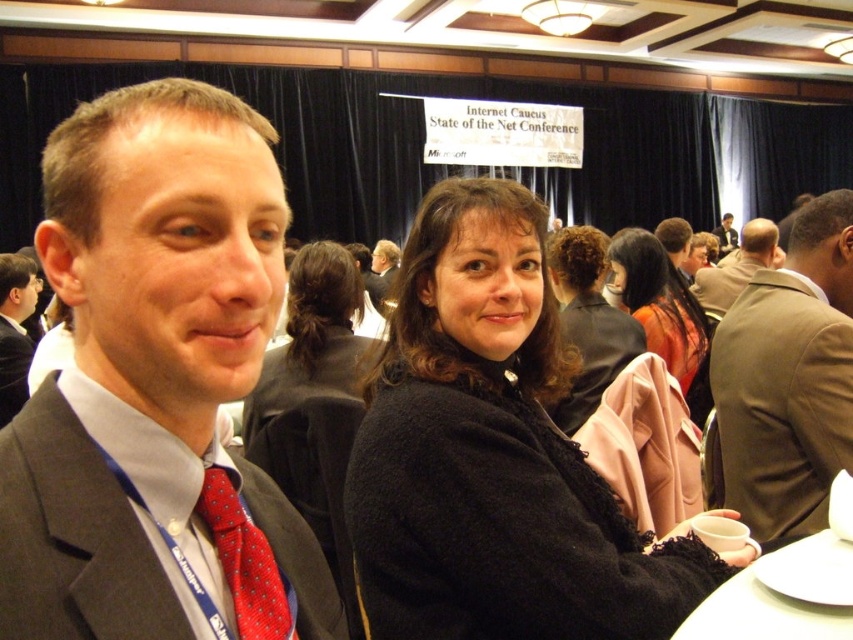
Who is more forward, (x=212, y=422) or (x=732, y=460)?

Point (x=212, y=422) is more forward.

Where is `matte black suit at center`? matte black suit at center is located at coordinates (155, 387).

Does orange fabric coat at center have a lesser width compared to red dotted tie at left?

Incorrect, orange fabric coat at center's width is not less than red dotted tie at left's.

The width and height of the screenshot is (853, 640). Find the location of `orange fabric coat at center`. orange fabric coat at center is located at coordinates (657, 301).

This screenshot has width=853, height=640. Find the location of `orange fabric coat at center`. orange fabric coat at center is located at coordinates (657, 301).

Locate an element on the screen. This screenshot has height=640, width=853. orange fabric coat at center is located at coordinates (657, 301).

Who is positioned more to the right, brown wool suit at right or matte black suit at upper center?

From the viewer's perspective, matte black suit at upper center appears more on the right side.

Can you confirm if brown wool suit at right is positioned to the left of matte black suit at upper center?

Correct, you'll find brown wool suit at right to the left of matte black suit at upper center.

Between point (723, 477) and point (724, 248), which one is positioned in front?

Point (723, 477)

Image resolution: width=853 pixels, height=640 pixels. What are the coordinates of `brown wool suit at right` in the screenshot? It's located at (788, 378).